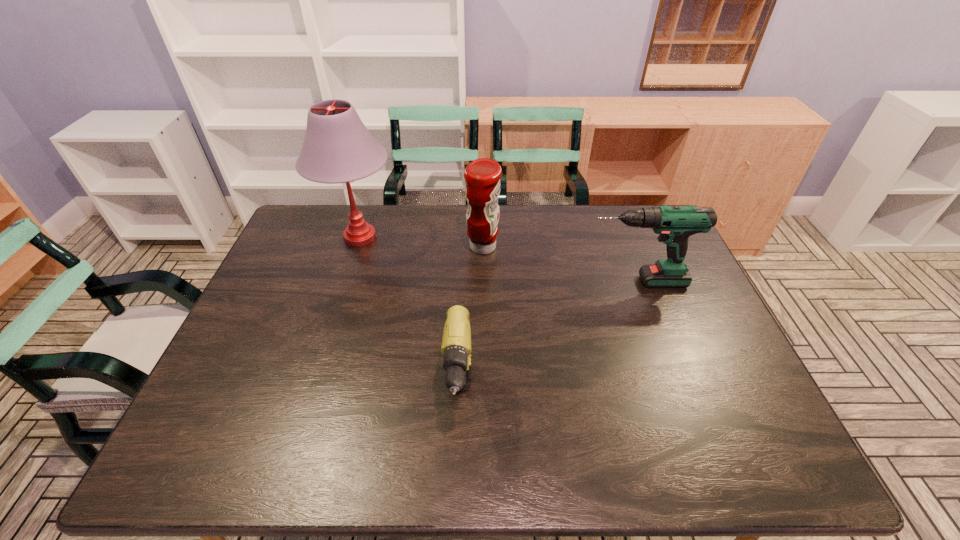
Identify the location of unoccupied position between the nearer drill and the table lamp. The width and height of the screenshot is (960, 540). (410, 318).

Locate an element on the screen. This screenshot has height=540, width=960. free area in between the condiment and the leftmost object is located at coordinates tap(421, 242).

The height and width of the screenshot is (540, 960). What are the coordinates of `blank region between the tallest object and the taller drill` in the screenshot? It's located at (498, 259).

Identify the location of vacant point located between the condiment and the rightmost object. This screenshot has height=540, width=960. (x=560, y=264).

Select which object appears as the third closest to the right drill. Please provide its 2D coordinates. Your answer should be formatted as a tuple, i.e. [(x, y)], where the tuple contains the x and y coordinates of a point satisfying the conditions above.

[(338, 148)]

Image resolution: width=960 pixels, height=540 pixels. What are the coordinates of `object that is the second nearest to the condiment` in the screenshot? It's located at (675, 224).

Locate an element on the screen. Image resolution: width=960 pixels, height=540 pixels. free point that satisfies the following two spatial constraints: 1. on the handle side of the third farthest object; 2. on the handle side of the shortest object is located at coordinates (680, 399).